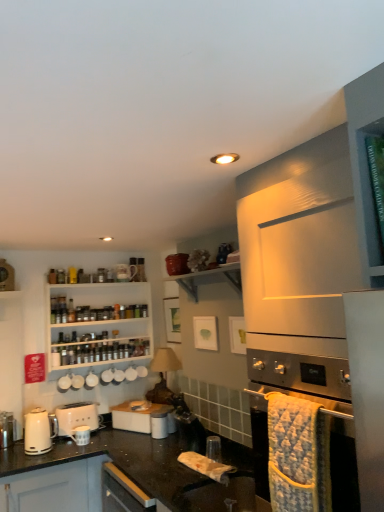
I want to click on free space in front of white glossy toaster at center, so click(131, 437).